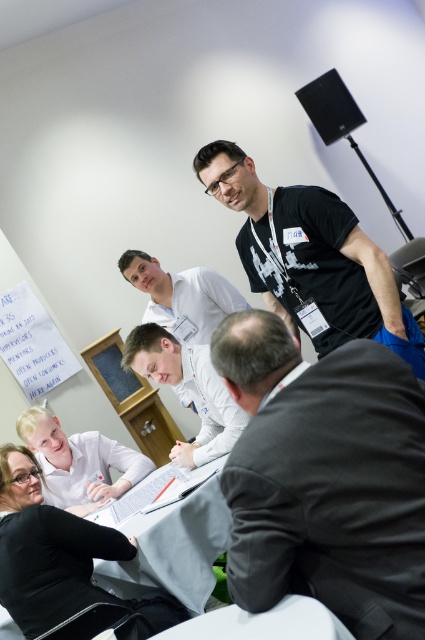
Who is positioned more to the left, black fabric shirt at lower left or white shirt at center?

black fabric shirt at lower left

Between point (47, 536) and point (209, 285), which one is positioned behind?

The point (209, 285) is more distant.

Locate an element on the screen. The height and width of the screenshot is (640, 425). black fabric shirt at lower left is located at coordinates (57, 556).

Is the position of white fabric table at center less distant than that of white shirt at center?

Yes, it is.

Is point (207, 480) farther from viewer compared to point (192, 298)?

No, it is not.

The image size is (425, 640). I want to click on white fabric table at center, so click(175, 545).

Does white fabric table at center appear over light blue shirt at lower left?

Actually, white fabric table at center is below light blue shirt at lower left.

Is white fabric table at center bigger than light blue shirt at lower left?

A: Correct, white fabric table at center is larger in size than light blue shirt at lower left.

Is point (193, 604) closer to camera compared to point (59, 484)?

Yes, it is.

In order to click on white fabric table at center in this screenshot , I will do `click(175, 545)`.